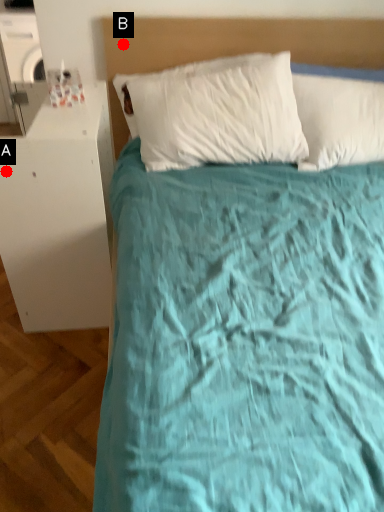
Question: Two points are circled on the image, labeled by A and B beside each circle. Which of the following is the farthest from the observer?

Choices:
 (A) A is further
 (B) B is further

Answer: (B)